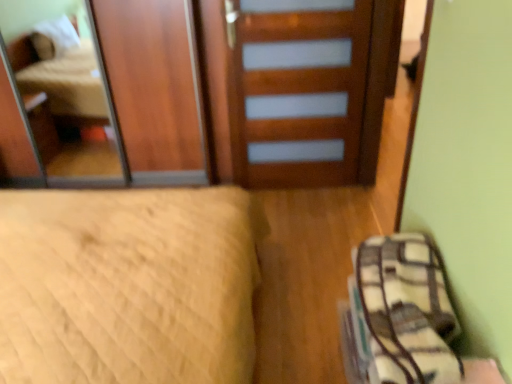
Question: From a real-world perspective, is plaid fabric bag at lower right above or below wooden door at center?

Choices:
 (A) above
 (B) below

Answer: (B)

Question: Is plaid fabric bag at lower right in front of or behind wooden door at center in the image?

Choices:
 (A) behind
 (B) front

Answer: (B)

Question: Based on their relative distances, which object is nearer to the wooden door at center?

Choices:
 (A) plaid fabric bag at lower right
 (B) wooden mirror at upper left
 (C) beige quilted bed at lower left

Answer: (C)

Question: Based on their relative distances, which object is farther from the wooden mirror at upper left?

Choices:
 (A) wooden door at center
 (B) beige quilted bed at lower left
 (C) plaid fabric bag at lower right

Answer: (C)